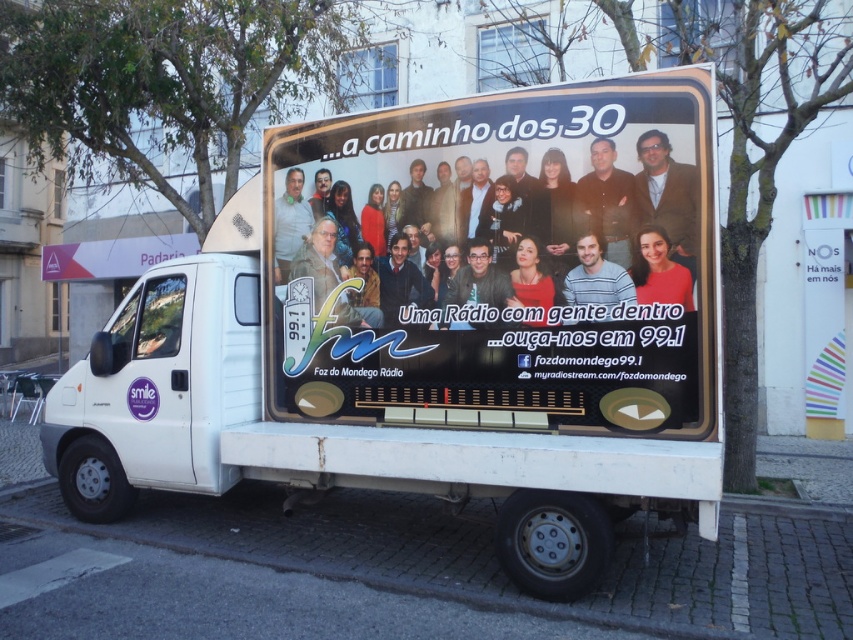
Is white glossy truck at center positioned in front of matte white billboard at center?

Yes, it is.

Is white glossy truck at center above matte white billboard at center?

No, white glossy truck at center is not above matte white billboard at center.

Which is behind, point (396, 433) or point (297, 356)?

The point (297, 356) is more distant.

Image resolution: width=853 pixels, height=640 pixels. Find the location of `white glossy truck at center`. white glossy truck at center is located at coordinates (419, 333).

Can you confirm if white glossy truck at center is wider than matte black glasses at center?

Correct, the width of white glossy truck at center exceeds that of matte black glasses at center.

The image size is (853, 640). I want to click on white glossy truck at center, so click(419, 333).

Can you confirm if matte black glasses at center is thinner than matte red shirt at center?

No, matte black glasses at center is not thinner than matte red shirt at center.

Is the position of matte black glasses at center less distant than that of matte red shirt at center?

That is False.

The height and width of the screenshot is (640, 853). Find the location of `matte black glasses at center`. matte black glasses at center is located at coordinates (479, 288).

Locate an element on the screen. The image size is (853, 640). matte black glasses at center is located at coordinates (479, 288).